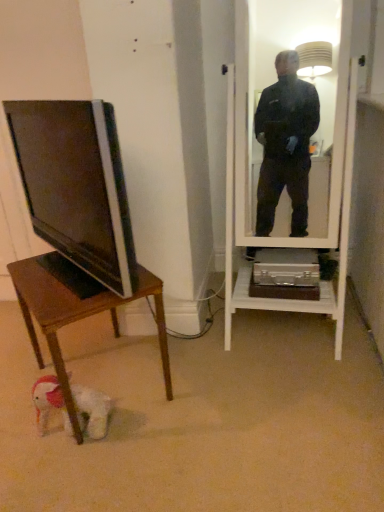
Find the location of `free space in front of wooden desk at lower left`. free space in front of wooden desk at lower left is located at coordinates (103, 466).